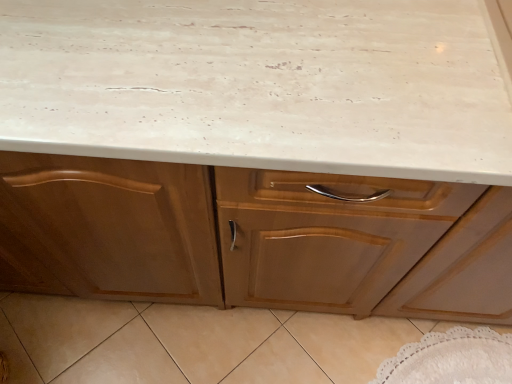
You are a GUI agent. You are given a task and a screenshot of the screen. Output one action in this format:
    pyautogui.click(x=<x>, y=<y>)
    Task: Click on the free spot above white marble countertop at center (from a real-world perspective)
    
    Given the screenshot: What is the action you would take?
    pyautogui.click(x=280, y=50)